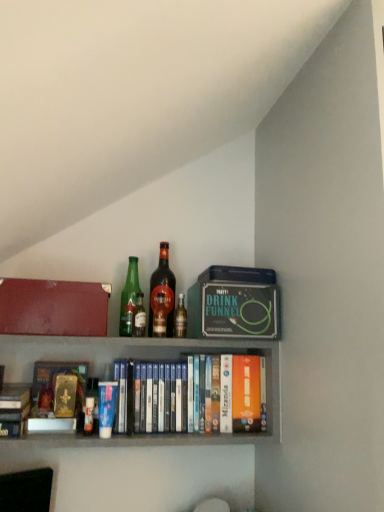
What is the approximate height of translucent glass bottle at center, the first bottle when ordered from right to left?

translucent glass bottle at center, the first bottle when ordered from right to left, is 5.24 inches tall.

What is the approximate height of brown glass bottle at center, the 2th bottle in the right-to-left sequence?

The height of brown glass bottle at center, the 2th bottle in the right-to-left sequence, is 11.75 inches.

What do you see at coordinates (239, 310) in the screenshot? Image resolution: width=384 pixels, height=512 pixels. I see `matte black drink funnel at upper center, which is the first paperback book in back-to-front order` at bounding box center [239, 310].

In order to click on matte black drink funnel at upper center, which is the first paperback book in back-to-front order in this screenshot , I will do `click(239, 310)`.

Measure the distance between point (138, 298) and camera.

Point (138, 298) is 1.19 meters from camera.

This screenshot has width=384, height=512. I want to click on matte red box at upper left, so click(x=53, y=308).

You are a GUI agent. You are given a task and a screenshot of the screen. Output one action in this format:
    pyautogui.click(x=<x>, y=<y>)
    Task: Click on the translucent glass bottle at center, the first bottle when ordered from right to left
    The image size is (384, 512).
    Given the screenshot: What is the action you would take?
    pyautogui.click(x=180, y=318)

Considering the sizes of objects blue matte paperback book at lower left, which is the second paperback book from back to front, and green glass bottle at center, arranged as the 4th bottle when viewed from the right, in the image provided, who is shorter, blue matte paperback book at lower left, which is the second paperback book from back to front, or green glass bottle at center, arranged as the 4th bottle when viewed from the right,?

With less height is blue matte paperback book at lower left, which is the second paperback book from back to front.

Is blue matte paperback book at lower left, which is the second paperback book from back to front, thinner than green glass bottle at center, arranged as the 4th bottle when viewed from the right?

Yes, blue matte paperback book at lower left, which is the second paperback book from back to front, is thinner than green glass bottle at center, arranged as the 4th bottle when viewed from the right.

Considering the relative sizes of blue matte paperback book at lower left, which is the second paperback book from back to front, and green glass bottle at center, which is the first bottle in left-to-right order, in the image provided, is blue matte paperback book at lower left, which is the second paperback book from back to front, bigger than green glass bottle at center, which is the first bottle in left-to-right order,?

No, blue matte paperback book at lower left, which is the second paperback book from back to front, is not bigger than green glass bottle at center, which is the first bottle in left-to-right order.

Could you tell me if blue matte paperback book at lower left, which is counted as the first paperback book, starting from the front, is turned towards green glass bottle at center, arranged as the 4th bottle when viewed from the right?

No, blue matte paperback book at lower left, which is counted as the first paperback book, starting from the front, is not oriented towards green glass bottle at center, arranged as the 4th bottle when viewed from the right.

From a real-world perspective, is green glass bottle at center, which is the 2th bottle in left-to-right order, physically above wooden books at center?

Yes, from a real-world perspective, green glass bottle at center, which is the 2th bottle in left-to-right order, is over wooden books at center

Can you tell me how much green glass bottle at center, which is the 2th bottle in left-to-right order, and wooden books at center differ in facing direction?

The facing directions of green glass bottle at center, which is the 2th bottle in left-to-right order, and wooden books at center are 3.04 degrees apart.

Is green glass bottle at center, which is the 2th bottle in left-to-right order, to the left of wooden books at center from the viewer's perspective?

No.

In the scene shown: Is the position of green glass bottle at center, which is the 2th bottle in left-to-right order, more distant than that of wooden books at center?

Yes, green glass bottle at center, which is the 2th bottle in left-to-right order, is behind wooden books at center.

In terms of width, does matte red box at upper left look wider or thinner when compared to brown glass bottle at center, the 2th bottle in the right-to-left sequence?

Considering their sizes, matte red box at upper left looks broader than brown glass bottle at center, the 2th bottle in the right-to-left sequence.

Is matte red box at upper left placed right next to brown glass bottle at center, acting as the 3th bottle starting from the left?

No, matte red box at upper left is not beside brown glass bottle at center, acting as the 3th bottle starting from the left.

Is point (81, 315) positioned before point (165, 249)?

Yes, it is in front of point (165, 249).

Considering the relative sizes of matte red box at upper left and brown glass bottle at center, the 2th bottle in the right-to-left sequence, in the image provided, is matte red box at upper left smaller than brown glass bottle at center, the 2th bottle in the right-to-left sequence,?

Incorrect, matte red box at upper left is not smaller in size than brown glass bottle at center, the 2th bottle in the right-to-left sequence.

Which object is positioned more to the left, green glass bottle at center, arranged as the 4th bottle when viewed from the right, or matte red box at upper left?

From the viewer's perspective, matte red box at upper left appears more on the left side.

Does green glass bottle at center, arranged as the 4th bottle when viewed from the right, have a lesser width compared to matte red box at upper left?

Yes.

Is green glass bottle at center, arranged as the 4th bottle when viewed from the right, not within matte red box at upper left?

Yes, green glass bottle at center, arranged as the 4th bottle when viewed from the right, is not within matte red box at upper left.

Between green glass bottle at center, arranged as the 4th bottle when viewed from the right, and matte red box at upper left, which one is positioned behind?

Positioned behind is green glass bottle at center, arranged as the 4th bottle when viewed from the right.

What's the angular difference between matte black drink funnel at upper center, arranged as the first paperback book when viewed from the right, and matte red box at upper left's facing directions?

There is a 0.862-degree angle between the facing directions of matte black drink funnel at upper center, arranged as the first paperback book when viewed from the right, and matte red box at upper left.

Which of these two, matte black drink funnel at upper center, which is counted as the 1th paperback book, starting from the top, or matte red box at upper left, stands taller?

Standing taller between the two is matte black drink funnel at upper center, which is counted as the 1th paperback book, starting from the top.

Looking at the image, does matte black drink funnel at upper center, which is the second paperback book from bottom to top, seem bigger or smaller compared to matte red box at upper left?

matte black drink funnel at upper center, which is the second paperback book from bottom to top, is smaller than matte red box at upper left.

Which is in front, point (211, 330) or point (99, 313)?

The point (99, 313) is more forward.

How different are the orientations of wooden books at center and blue matte paperback book at lower left, positioned as the 2th paperback book in top-to-bottom order, in degrees?

1.79 degrees.

Is wooden books at center not within blue matte paperback book at lower left, the second paperback book viewed from the right?

That's correct, wooden books at center is outside of blue matte paperback book at lower left, the second paperback book viewed from the right.

Does point (69, 344) lie behind point (108, 405)?

Yes.

Are wooden books at center and blue matte paperback book at lower left, positioned as the 2th paperback book in top-to-bottom order, far apart?

wooden books at center is actually quite close to blue matte paperback book at lower left, positioned as the 2th paperback book in top-to-bottom order.

Considering the points (136, 335) and (211, 295), which point is in front, point (136, 335) or point (211, 295)?

Positioned in front is point (211, 295).

Based on the photo, could you measure the distance between green glass bottle at center, the third bottle positioned from the right, and matte black drink funnel at upper center, which is counted as the 1th paperback book, starting from the top?

green glass bottle at center, the third bottle positioned from the right, is 24.47 centimeters away from matte black drink funnel at upper center, which is counted as the 1th paperback book, starting from the top.

Is green glass bottle at center, the third bottle positioned from the right, facing away from matte black drink funnel at upper center, which is counted as the 1th paperback book, starting from the top?

green glass bottle at center, the third bottle positioned from the right, is not turned away from matte black drink funnel at upper center, which is counted as the 1th paperback book, starting from the top.

Is the depth of green glass bottle at center, the third bottle positioned from the right, greater than that of matte black drink funnel at upper center, which is the second paperback book from bottom to top?

Yes, it is behind matte black drink funnel at upper center, which is the second paperback book from bottom to top.

Which bottle is the 4th one when counting from the back of the blue matte paperback book at lower left, positioned as the 2th paperback book in top-to-bottom order? Please provide its 2D coordinates.

[(129, 298)]

Locate an element on the screen. This screenshot has height=512, width=384. the 1st bottle counting from the right side of the wooden books at center is located at coordinates (139, 317).

Considering their positions, is translucent glass bottle at center, the first bottle when ordered from right to left, positioned further to wooden books at center than blue matte paperback book at lower left, the 1th paperback book positioned from the bottom?

translucent glass bottle at center, the first bottle when ordered from right to left.

When comparing their distances from blue matte paperback book at lower left, which appears as the 1th paperback book when viewed from the left, does green glass bottle at center, the third bottle positioned from the right, or wooden books at center seem further?

Based on the image, wooden books at center appears to be further to blue matte paperback book at lower left, which appears as the 1th paperback book when viewed from the left.

Based on their spatial positions, is brown glass bottle at center, acting as the 3th bottle starting from the left, or green glass bottle at center, arranged as the 4th bottle when viewed from the right, closer to matte black drink funnel at upper center, which is the second paperback book from bottom to top?

brown glass bottle at center, acting as the 3th bottle starting from the left, is closer to matte black drink funnel at upper center, which is the second paperback book from bottom to top.

From the image, which object appears to be farther from translucent glass bottle at center, which is counted as the 4th bottle, starting from the left, matte red box at upper left or green glass bottle at center, arranged as the 4th bottle when viewed from the right?

matte red box at upper left is positioned further to the anchor translucent glass bottle at center, which is counted as the 4th bottle, starting from the left.

From the image, which object appears to be nearer to translucent glass bottle at center, the first bottle when ordered from right to left, matte red box at upper left or blue matte paperback book at lower left, which is counted as the first paperback book, starting from the front?

blue matte paperback book at lower left, which is counted as the first paperback book, starting from the front, is closer to translucent glass bottle at center, the first bottle when ordered from right to left.

Considering their positions, is matte red box at upper left positioned further to blue matte paperback book at lower left, positioned as the 2th paperback book in top-to-bottom order, than brown glass bottle at center, the 2th bottle in the right-to-left sequence?

brown glass bottle at center, the 2th bottle in the right-to-left sequence.

Estimate the real-world distances between objects in this image. Which object is further from wooden books at center, green glass bottle at center, arranged as the 4th bottle when viewed from the right, or green glass bottle at center, the third bottle positioned from the right?

Among the two, green glass bottle at center, the third bottle positioned from the right, is located further to wooden books at center.

Estimate the real-world distances between objects in this image. Which object is closer to translucent glass bottle at center, which is counted as the 4th bottle, starting from the left, matte red box at upper left or green glass bottle at center, which is the 2th bottle in left-to-right order?

Based on the image, green glass bottle at center, which is the 2th bottle in left-to-right order, appears to be nearer to translucent glass bottle at center, which is counted as the 4th bottle, starting from the left.

Identify the location of box positioned between wooden books at center and green glass bottle at center, which is the first bottle in left-to-right order, from near to far. (53, 308).

Where is `bottle between green glass bottle at center, which is the 2th bottle in left-to-right order, and translucent glass bottle at center, the first bottle when ordered from right to left, from left to right`? The width and height of the screenshot is (384, 512). bottle between green glass bottle at center, which is the 2th bottle in left-to-right order, and translucent glass bottle at center, the first bottle when ordered from right to left, from left to right is located at coordinates (163, 291).

The image size is (384, 512). In order to click on box between brown glass bottle at center, acting as the 3th bottle starting from the left, and blue matte paperback book at lower left, which is counted as the first paperback book, starting from the front, in the vertical direction in this screenshot , I will do `click(53, 308)`.

The height and width of the screenshot is (512, 384). Identify the location of shelf between green glass bottle at center, arranged as the 4th bottle when viewed from the right, and blue matte paperback book at lower left, which appears as the 1th paperback book when viewed from the left, in the vertical direction. (140, 359).